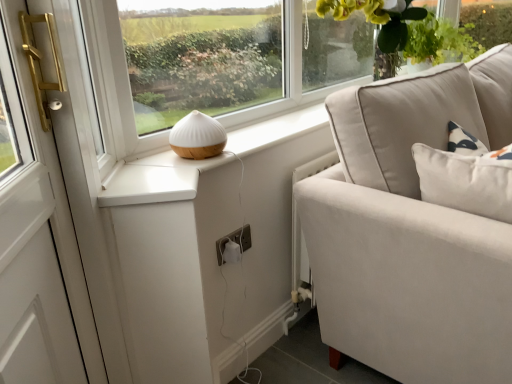
Question: Is white matte table lamp at center far from green leafy plant at upper right?

Choices:
 (A) no
 (B) yes

Answer: (B)

Question: Is green leafy plant at upper right inside white matte table lamp at center?

Choices:
 (A) no
 (B) yes

Answer: (A)

Question: Does white matte table lamp at center come in front of green leafy plant at upper right?

Choices:
 (A) no
 (B) yes

Answer: (B)

Question: Is white matte table lamp at center with green leafy plant at upper right?

Choices:
 (A) no
 (B) yes

Answer: (A)

Question: Is white matte table lamp at center positioned behind green leafy plant at upper right?

Choices:
 (A) no
 (B) yes

Answer: (A)

Question: In the image, is green leafy plant at upper right positioned in front of or behind white plastic electric outlet at lower center?

Choices:
 (A) front
 (B) behind

Answer: (B)

Question: In terms of size, does green leafy plant at upper right appear bigger or smaller than white plastic electric outlet at lower center?

Choices:
 (A) big
 (B) small

Answer: (A)

Question: Is green leafy plant at upper right taller or shorter than white plastic electric outlet at lower center?

Choices:
 (A) short
 (B) tall

Answer: (B)

Question: Considering the positions of green leafy plant at upper right and white plastic electric outlet at lower center in the image, is green leafy plant at upper right wider or thinner than white plastic electric outlet at lower center?

Choices:
 (A) wide
 (B) thin

Answer: (A)

Question: Is white matte table lamp at center wider or thinner than white plastic electric outlet at lower center?

Choices:
 (A) wide
 (B) thin

Answer: (A)

Question: From a real-world perspective, relative to white plastic electric outlet at lower center, is white matte table lamp at center vertically above or below?

Choices:
 (A) above
 (B) below

Answer: (A)

Question: Is white matte table lamp at center inside the boundaries of white plastic electric outlet at lower center, or outside?

Choices:
 (A) outside
 (B) inside

Answer: (A)

Question: Based on their positions, is white matte table lamp at center located to the left or right of white plastic electric outlet at lower center?

Choices:
 (A) right
 (B) left

Answer: (B)

Question: From a real-world perspective, relative to green leafy plant at upper right, is white matte table lamp at center vertically above or below?

Choices:
 (A) above
 (B) below

Answer: (B)

Question: In terms of size, does white matte table lamp at center appear bigger or smaller than green leafy plant at upper right?

Choices:
 (A) big
 (B) small

Answer: (B)